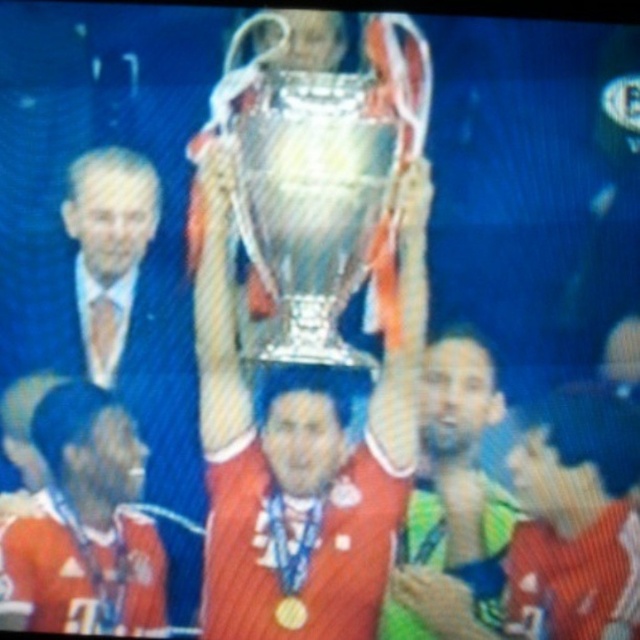
In the scene where a group is celebrating with a metallic trophy at center and a blue fabric head at center, which object is positioned higher?

The metallic trophy at center is positioned higher than the blue fabric head at center.

You are a photographer at the event. You need to capture a photo where the metallic trophy at center and the white hair at left are both clearly visible. Based on their positions, which object should you focus on first to ensure both are in frame?

The metallic trophy at center is positioned on the right side of white hair at left, so you should focus on the white hair at left first to ensure both are in frame since it is on the left and the trophy is to its right.